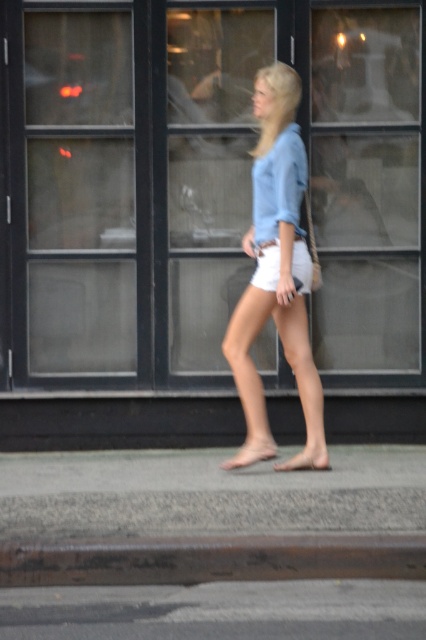
You are standing at point (294, 456) and want to walk to point (308, 515). Given the scene described, is the path between these two points clear of any obstacles?

Yes, the path between point (308, 515) and point (294, 456) is clear because the woman is walking along the sidewalk in front of the storefront and there are no mentioned obstacles in the scene description.

In the scene shown: You are a pedestrian standing on the sidewalk. You see the gray asphalt at lower center and the barefoot sandal at lower center. Which object is closer to you?

The gray asphalt at lower center is in front of the barefoot sandal at lower center, so the gray asphalt at lower center is closer to you.